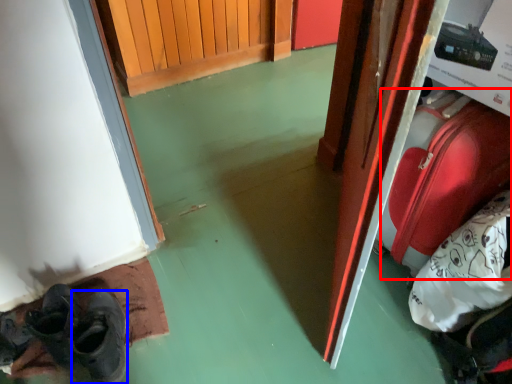
Question: Which object appears closest to the camera in this image, luggage (highlighted by a red box) or shoe (highlighted by a blue box)?

Choices:
 (A) luggage
 (B) shoe

Answer: (A)